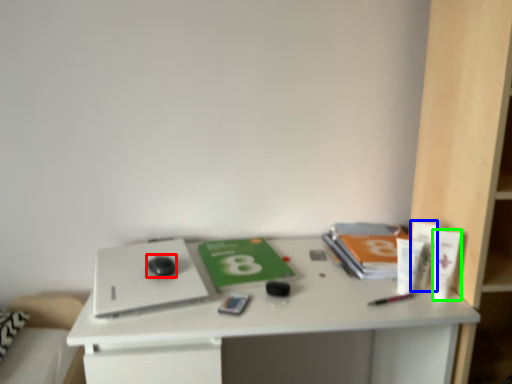
Question: Which object is positioned farthest from mouse (highlighted by a red box)? Select from toiletry (highlighted by a blue box) and toiletry (highlighted by a green box).

Choices:
 (A) toiletry
 (B) toiletry

Answer: (B)